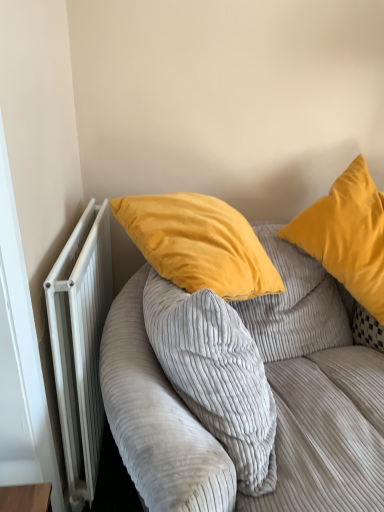
Question: From a real-world perspective, is white metallic radiator at left physically located above or below velvet yellow pillow at upper right?

Choices:
 (A) below
 (B) above

Answer: (A)

Question: From the image's perspective, relative to velvet yellow pillow at upper right, is white metallic radiator at left above or below?

Choices:
 (A) below
 (B) above

Answer: (A)

Question: Based on their relative distances, which object is farther from the velvet yellow pillow at upper right?

Choices:
 (A) white metallic radiator at left
 (B) corduroy fabric couch at upper right

Answer: (A)

Question: Estimate the real-world distances between objects in this image. Which object is farther from the velvet yellow pillow at upper right?

Choices:
 (A) white metallic radiator at left
 (B) corduroy fabric couch at upper right

Answer: (A)